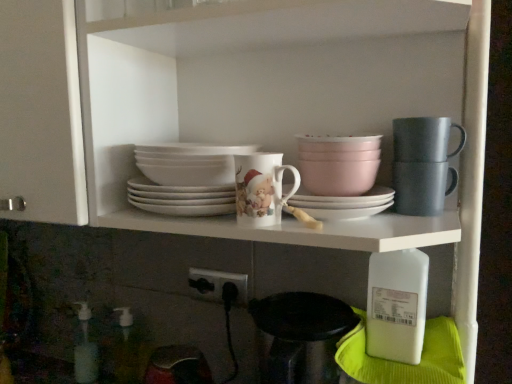
Question: In the image, is white matte platter at center positioned in front of or behind translucent plastic soap dispenser at lower left, which ranks as the 2th bottle in back-to-front order?

Choices:
 (A) front
 (B) behind

Answer: (A)

Question: From the image's perspective, is white matte platter at center positioned above or below translucent plastic soap dispenser at lower left, which ranks as the 2th bottle in back-to-front order?

Choices:
 (A) below
 (B) above

Answer: (B)

Question: Which object is the closest to the white matte platter at center?

Choices:
 (A) matte gray mug at upper right
 (B) translucent plastic soap dispenser at lower left, which ranks as the 2th bottle in back-to-front order
 (C) white plastic bottle at lower right, which is the third bottle in back-to-front order
 (D) pink matte bowl at upper center, acting as the 1th tableware starting from the left
 (E) matte gray mug at upper right, arranged as the first tableware when viewed from the right

Answer: (D)

Question: Considering the real-world distances, which object is farthest from the white plastic bottle at lower right, placed as the 3th bottle when sorted from left to right?

Choices:
 (A) white matte platter at center
 (B) porcelain cup at center
 (C) matte gray mug at upper right, acting as the second tableware starting from the left
 (D) translucent plastic bottle at lower left, placed as the first bottle when sorted from left to right
 (E) translucent plastic soap dispenser at lower left, marked as the second bottle in a front-to-back arrangement

Answer: (D)